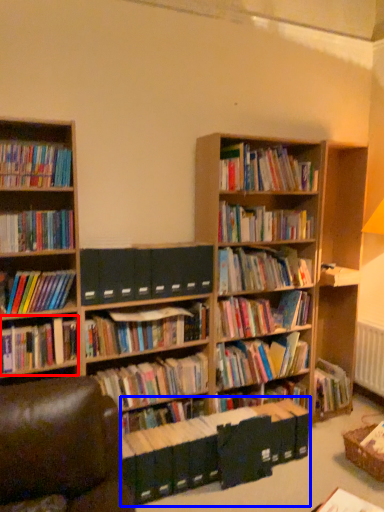
Question: Which of the following is the farthest to the observer, book (highlighted by a red box) or book (highlighted by a blue box)?

Choices:
 (A) book
 (B) book

Answer: (A)